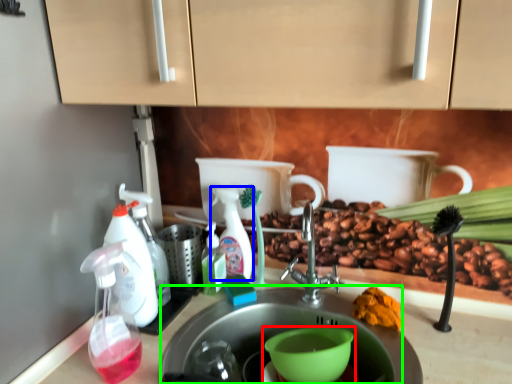
Question: Estimate the real-world distances between objects in this image. Which object is farther from coffee cup (highlighted by a red box), cleaning product (highlighted by a blue box) or sink (highlighted by a green box)?

Choices:
 (A) cleaning product
 (B) sink

Answer: (A)